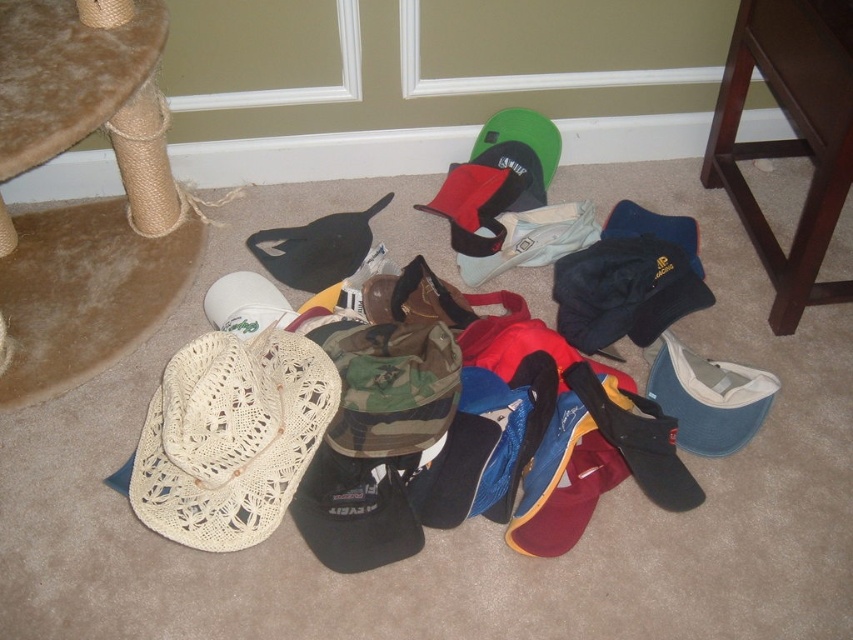
You are a person who wants to place a small potted plant between the woven straw cowboy hat at lower left and the dark wood stool at lower right. Can you fit it vertically without the plant touching either object?

The woven straw cowboy hat at lower left is shorter than the dark wood stool at lower right, so the plant can be placed vertically between them as long as its height is less than the shorter object, which is the woven straw cowboy hat at lower left.